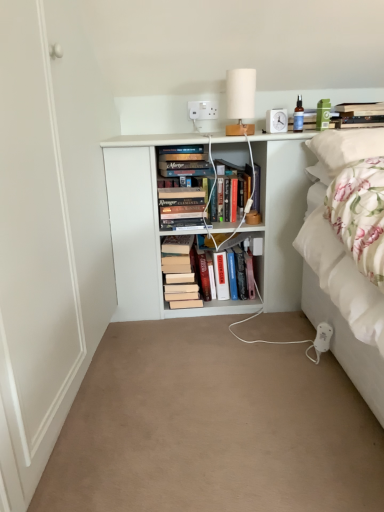
Question: Is white fabric lampshade at upper center to the right of white plastic socket at upper center from the viewer's perspective?

Choices:
 (A) yes
 (B) no

Answer: (A)

Question: Is white plastic socket at upper center at the back of white fabric lampshade at upper center?

Choices:
 (A) yes
 (B) no

Answer: (B)

Question: Is white fabric lampshade at upper center further to camera compared to white plastic socket at upper center?

Choices:
 (A) no
 (B) yes

Answer: (A)

Question: Is white fabric lampshade at upper center not inside white plastic socket at upper center?

Choices:
 (A) yes
 (B) no

Answer: (A)

Question: Is white fabric lampshade at upper center taller than white plastic socket at upper center?

Choices:
 (A) no
 (B) yes

Answer: (B)

Question: Is white fabric lampshade at upper center shorter than white plastic socket at upper center?

Choices:
 (A) yes
 (B) no

Answer: (B)

Question: Is white matte bookshelf at center positioned with its back to hardcover book at center, the second book in the top-to-bottom sequence?

Choices:
 (A) no
 (B) yes

Answer: (B)

Question: Can you confirm if white matte bookshelf at center is wider than hardcover book at center, which ranks as the second book in right-to-left order?

Choices:
 (A) no
 (B) yes

Answer: (B)

Question: Is there a large distance between white matte bookshelf at center and hardcover book at center, the 2th book positioned from the left?

Choices:
 (A) yes
 (B) no

Answer: (B)

Question: Considering the relative sizes of white matte bookshelf at center and hardcover book at center, the second book ordered from the bottom, in the image provided, is white matte bookshelf at center smaller than hardcover book at center, the second book ordered from the bottom,?

Choices:
 (A) yes
 (B) no

Answer: (B)

Question: Can you confirm if white matte bookshelf at center is taller than hardcover book at center, which ranks as the second book in right-to-left order?

Choices:
 (A) no
 (B) yes

Answer: (B)

Question: From a real-world perspective, is white matte bookshelf at center on hardcover book at center, the second book ordered from the bottom?

Choices:
 (A) no
 (B) yes

Answer: (B)

Question: Is the position of hardcover book at center, which ranks as the second book in right-to-left order, more distant than that of white fabric lampshade at upper center?

Choices:
 (A) yes
 (B) no

Answer: (A)